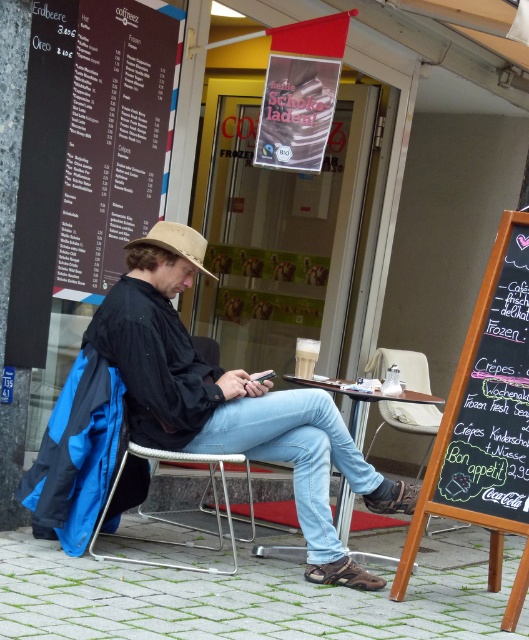
Question: Which point is farther from the camera taking this photo?

Choices:
 (A) click(196, 234)
 (B) click(259, 387)
 (C) click(341, 529)

Answer: (C)

Question: Can you confirm if brown paper menu at left is positioned above metallic wire chair at center?

Choices:
 (A) no
 (B) yes

Answer: (B)

Question: Is beige fabric chair at lower center wider than beige fabric fedora at center?

Choices:
 (A) no
 (B) yes

Answer: (B)

Question: Can you confirm if wooden table at center is positioned to the left of beige fabric fedora at center?

Choices:
 (A) yes
 (B) no

Answer: (B)

Question: Considering the real-world distances, which object is closest to the denim jeans at center?

Choices:
 (A) beige fabric fedora at center
 (B) black chalkboard at right
 (C) brown paper menu at left
 (D) beige fabric chair at lower center

Answer: (A)

Question: Which point is farther to the camera?

Choices:
 (A) beige fabric chair at lower center
 (B) denim jeans at center
 (C) metallic wire chair at center
 (D) black chalkboard at right

Answer: (A)